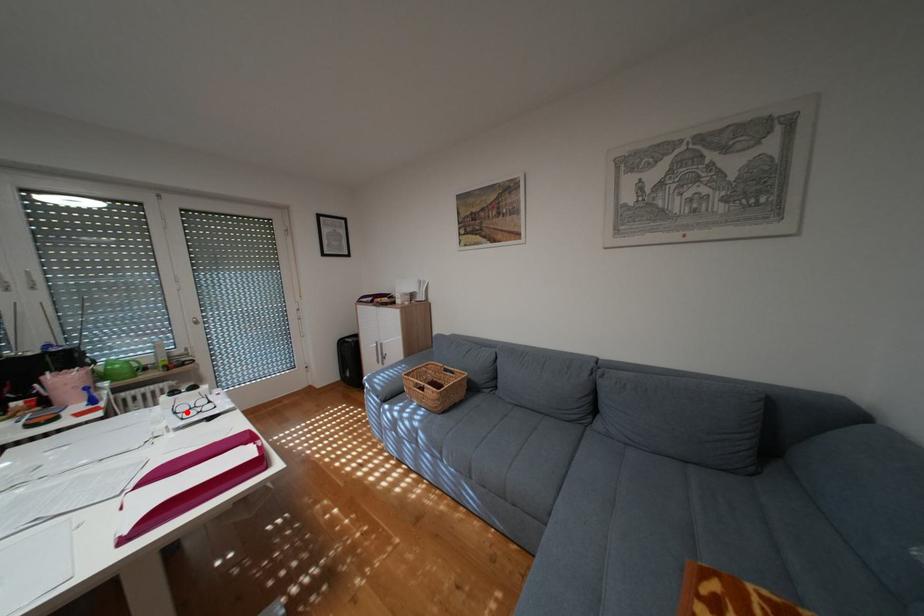
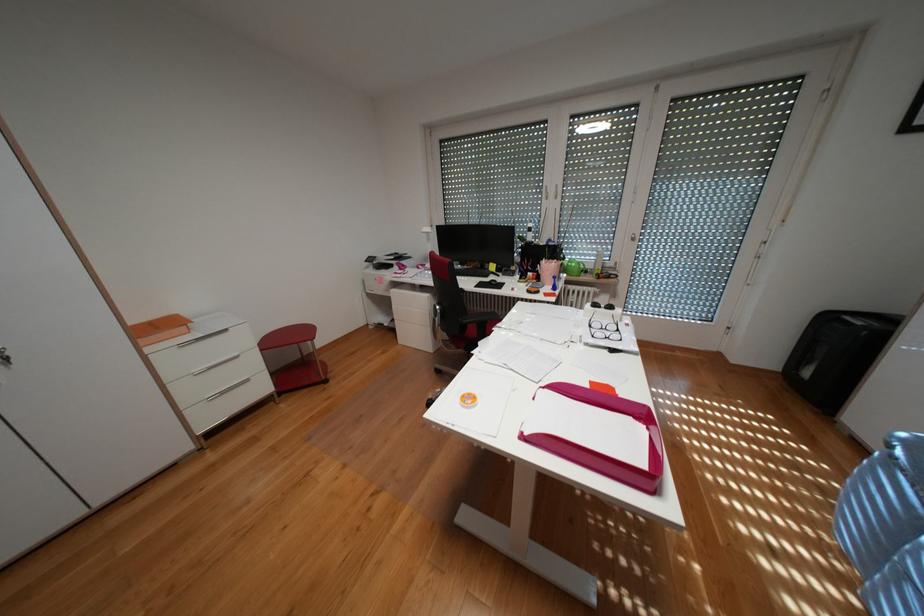
Where in the second image is the point corresponding to the highlighted location from the first image?

(602, 325)